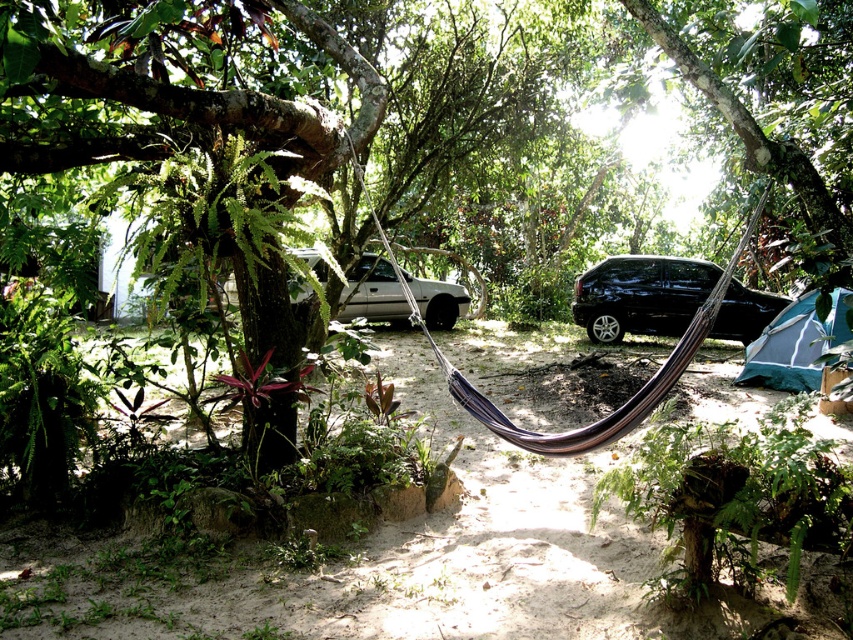
Question: Estimate the real-world distances between objects in this image. Which object is closer to the brown sandy ground at center?

Choices:
 (A) white matte car at center
 (B) black glossy car at center

Answer: (B)

Question: Which point appears farthest from the camera in this image?

Choices:
 (A) (651, 19)
 (B) (196, 301)

Answer: (B)

Question: Can you confirm if brown sandy ground at center is wider than black glossy car at center?

Choices:
 (A) no
 (B) yes

Answer: (B)

Question: Estimate the real-world distances between objects in this image. Which object is farther from the black glossy car at center?

Choices:
 (A) brown sandy ground at center
 (B) green rough bark tree at upper left
 (C) white matte car at center

Answer: (B)

Question: Observing the image, what is the correct spatial positioning of green rough bark tree at upper left in reference to white matte car at center?

Choices:
 (A) right
 (B) left

Answer: (A)

Question: Where is brown sandy ground at center located in relation to black glossy car at center in the image?

Choices:
 (A) left
 (B) right

Answer: (A)